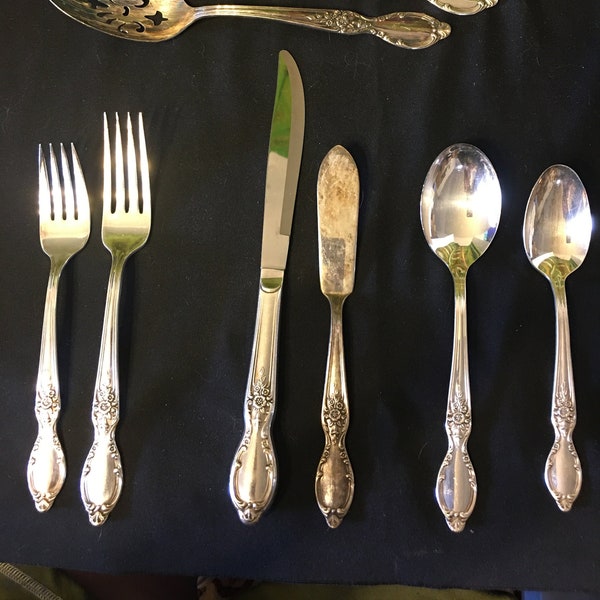
The width and height of the screenshot is (600, 600). Find the location of `visible floral design`. visible floral design is located at coordinates (46, 402), (103, 404), (256, 400), (336, 412), (460, 416), (562, 408), (339, 21).